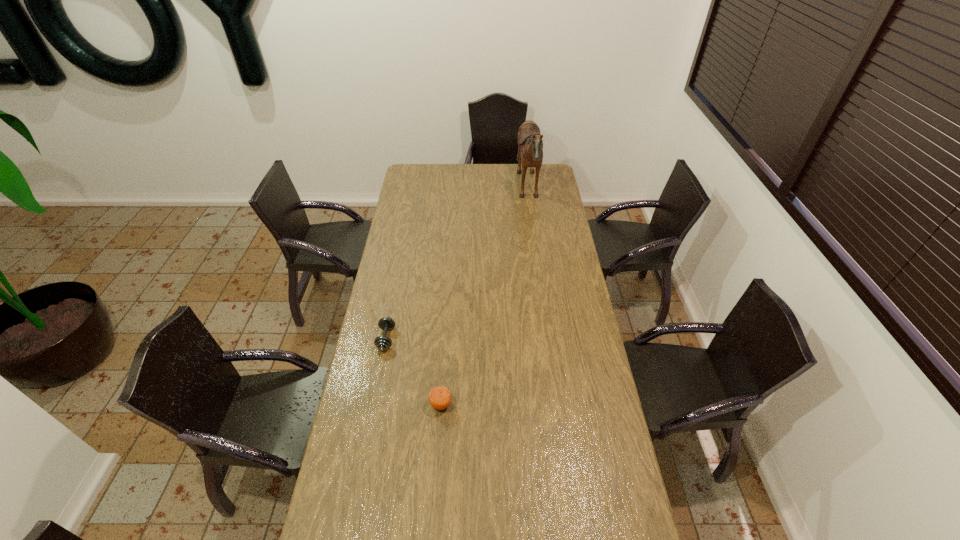
I want to click on free space between the shortest object and the second tallest object, so click(x=414, y=372).

Identify the location of free space between the second shortest object and the farthest object. (485, 298).

Image resolution: width=960 pixels, height=540 pixels. I want to click on unoccupied area between the leftmost object and the orange, so click(414, 372).

The height and width of the screenshot is (540, 960). Identify the location of object that is the closest to the second shortest object. (382, 343).

The image size is (960, 540). I want to click on the second closest object to the tallest object, so click(439, 397).

Identify the location of vacant region that satisfies the following two spatial constraints: 1. on the back of the tallest object; 2. on the front side of the second nearest object. The width and height of the screenshot is (960, 540). (549, 339).

The image size is (960, 540). What are the coordinates of `free space that satisfies the following two spatial constraints: 1. on the front side of the second farthest object; 2. on the left side of the second shortest object` in the screenshot? It's located at (373, 404).